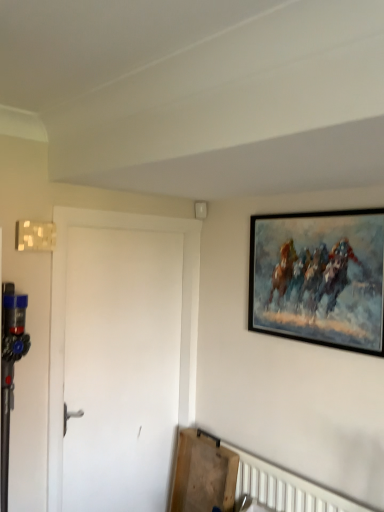
Question: Is white matte door at left to the right of black framed painting at upper right from the viewer's perspective?

Choices:
 (A) no
 (B) yes

Answer: (A)

Question: Are white matte door at left and black framed painting at upper right beside each other?

Choices:
 (A) no
 (B) yes

Answer: (A)

Question: Considering the relative sizes of white matte door at left and black framed painting at upper right in the image provided, is white matte door at left taller than black framed painting at upper right?

Choices:
 (A) yes
 (B) no

Answer: (A)

Question: Is white matte door at left wider than black framed painting at upper right?

Choices:
 (A) no
 (B) yes

Answer: (B)

Question: From the image's perspective, is white matte door at left beneath black framed painting at upper right?

Choices:
 (A) no
 (B) yes

Answer: (B)

Question: Does white matte door at left come behind black framed painting at upper right?

Choices:
 (A) no
 (B) yes

Answer: (B)

Question: Is black framed painting at upper right thinner than white matte door at left?

Choices:
 (A) no
 (B) yes

Answer: (B)

Question: From a real-world perspective, is black framed painting at upper right on white matte door at left?

Choices:
 (A) no
 (B) yes

Answer: (B)

Question: Is black framed painting at upper right not near white matte door at left?

Choices:
 (A) yes
 (B) no

Answer: (B)

Question: From a real-world perspective, is black framed painting at upper right physically below white matte door at left?

Choices:
 (A) no
 (B) yes

Answer: (A)

Question: Does black framed painting at upper right have a lesser height compared to white matte door at left?

Choices:
 (A) yes
 (B) no

Answer: (A)

Question: Is black framed painting at upper right to the left of white matte door at left from the viewer's perspective?

Choices:
 (A) yes
 (B) no

Answer: (B)

Question: Would you say white matte door at left is to the left or to the right of black framed painting at upper right in the picture?

Choices:
 (A) left
 (B) right

Answer: (A)